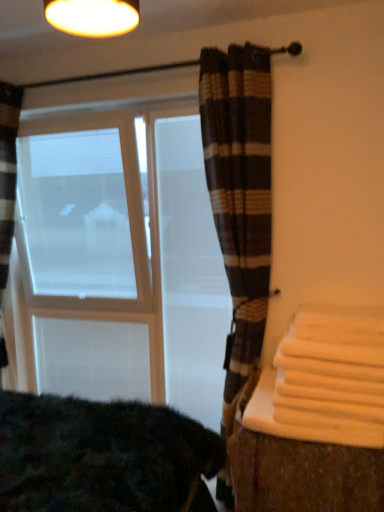
Question: Is dark textured blanket at lower left bigger or smaller than white matte screen door at center?

Choices:
 (A) big
 (B) small

Answer: (A)

Question: Looking at their shapes, would you say dark textured blanket at lower left is wider or thinner than white matte screen door at center?

Choices:
 (A) wide
 (B) thin

Answer: (A)

Question: Which object is the closest to the dark textured blanket at lower left?

Choices:
 (A) plaid fabric curtain at center
 (B) white matte window screen at left
 (C) orange cotton bath towel at right
 (D) white fabric at right
 (E) white matte screen door at center

Answer: (D)

Question: Which is farther from the white frosted glass bay window at left?

Choices:
 (A) white matte screen door at center
 (B) plaid fabric curtain at center
 (C) dark textured blanket at lower left
 (D) orange cotton bath towel at right
 (E) white matte window screen at left

Answer: (D)